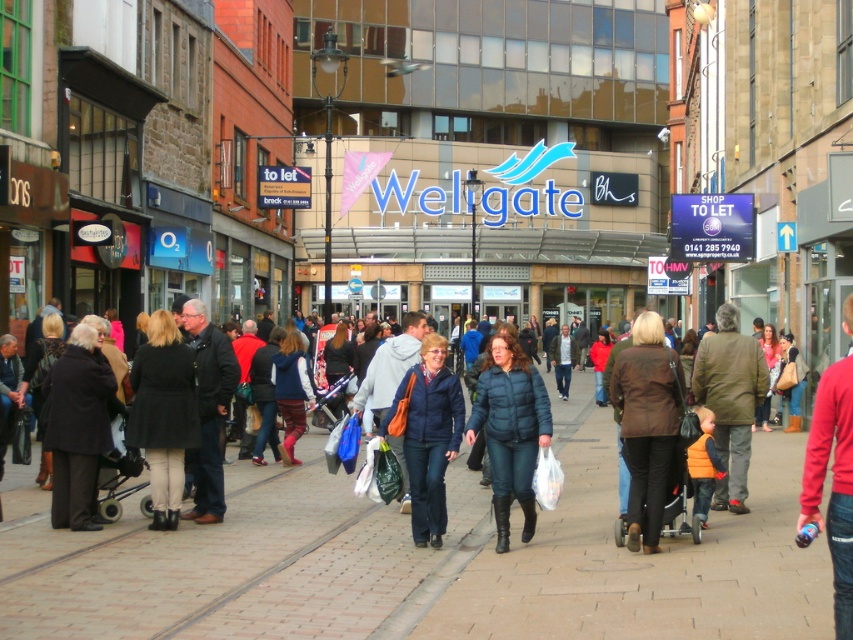
Locate an element on the screen. The width and height of the screenshot is (853, 640). brick pavement at center is located at coordinates (422, 561).

Who is more forward, (186, 564) or (408, 436)?

Positioned in front is point (186, 564).

Does point (822, 589) come closer to viewer compared to point (416, 518)?

Yes, point (822, 589) is closer to viewer.

This screenshot has height=640, width=853. In order to click on brick pavement at center in this screenshot , I will do `click(422, 561)`.

Which is behind, point (642, 368) or point (735, 426)?

Positioned behind is point (735, 426).

Between brown leather jacket at center and orange vest at center, which one appears on the right side from the viewer's perspective?

orange vest at center

Where is `brown leather jacket at center`? brown leather jacket at center is located at coordinates (647, 424).

Which is below, dark blue puffer jacket at center or matte blue jacket at center?

matte blue jacket at center

Locate an element on the screen. The height and width of the screenshot is (640, 853). dark blue puffer jacket at center is located at coordinates pos(509,429).

Locate an element on the screen. The image size is (853, 640). dark blue puffer jacket at center is located at coordinates [509, 429].